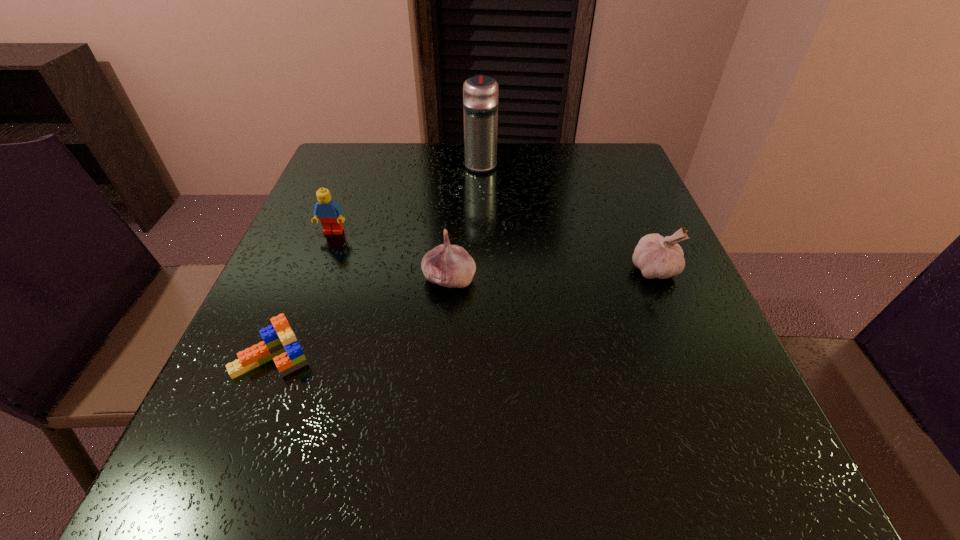
This screenshot has width=960, height=540. In order to click on unoccupied area between the farther Lego and the left garlic in this screenshot , I will do `click(392, 256)`.

Identify the location of free space that is in between the farthest object and the shortest object. The width and height of the screenshot is (960, 540). (376, 261).

Locate an element on the screen. object that ranks as the closest to the right garlic is located at coordinates (447, 265).

Point out which object is positioned as the fourth nearest to the thermos bottle. Please provide its 2D coordinates. Your answer should be formatted as a tuple, i.e. [(x, y)], where the tuple contains the x and y coordinates of a point satisfying the conditions above.

[(279, 343)]

You are a GUI agent. You are given a task and a screenshot of the screen. Output one action in this format:
    pyautogui.click(x=<x>, y=<y>)
    Task: Click on the blank space that satisfies the following two spatial constraints: 1. on the back side of the rightmost object; 2. on the right side of the left garlic
    
    Given the screenshot: What is the action you would take?
    pyautogui.click(x=450, y=269)

This screenshot has width=960, height=540. I want to click on vacant point that satisfies the following two spatial constraints: 1. on the back side of the rightmost object; 2. on the left side of the left garlic, so click(x=450, y=269).

The width and height of the screenshot is (960, 540). Identify the location of vacant region that satisfies the following two spatial constraints: 1. on the face of the fourth nearest object; 2. on the left side of the right garlic. (319, 269).